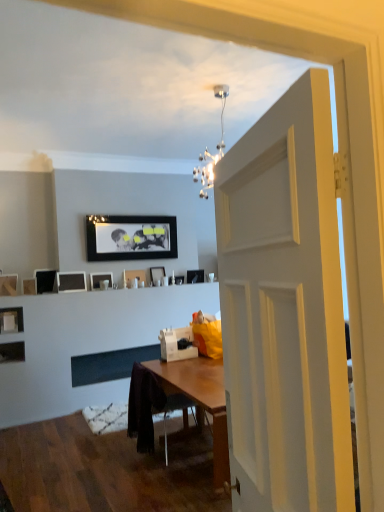
Question: Would you consider matte black picture frame at left, which ranks as the eleventh picture frame in right-to-left order, to be distant from matte black picture frame at upper center, which is counted as the first picture frame, starting from the right?

Choices:
 (A) yes
 (B) no

Answer: (A)

Question: From the image's perspective, does matte black picture frame at left, which is the 1th picture frame in left-to-right order, appear higher than matte black picture frame at upper center, placed as the eleventh picture frame when sorted from left to right?

Choices:
 (A) yes
 (B) no

Answer: (B)

Question: Does matte black picture frame at left, which is the 1th picture frame in left-to-right order, have a greater height compared to matte black picture frame at upper center, placed as the eleventh picture frame when sorted from left to right?

Choices:
 (A) yes
 (B) no

Answer: (A)

Question: From a real-world perspective, is matte black picture frame at left, which ranks as the eleventh picture frame in right-to-left order, located higher than matte black picture frame at upper center, placed as the eleventh picture frame when sorted from left to right?

Choices:
 (A) yes
 (B) no

Answer: (A)

Question: Is matte black picture frame at left, which ranks as the eleventh picture frame in right-to-left order, positioned with its back to matte black picture frame at upper center, placed as the eleventh picture frame when sorted from left to right?

Choices:
 (A) no
 (B) yes

Answer: (A)

Question: Does matte black picture frame at left, which ranks as the eleventh picture frame in right-to-left order, touch matte black picture frame at upper center, placed as the eleventh picture frame when sorted from left to right?

Choices:
 (A) no
 (B) yes

Answer: (A)

Question: From the image's perspective, would you say wooden chair at center is shown under matte black picture frame at left, which ranks as the eleventh picture frame in right-to-left order?

Choices:
 (A) yes
 (B) no

Answer: (A)

Question: Does wooden chair at center have a smaller size compared to matte black picture frame at left, which is the 1th picture frame in left-to-right order?

Choices:
 (A) no
 (B) yes

Answer: (A)

Question: From a real-world perspective, is wooden chair at center on matte black picture frame at left, which ranks as the eleventh picture frame in right-to-left order?

Choices:
 (A) no
 (B) yes

Answer: (A)

Question: From the image's perspective, is wooden chair at center on matte black picture frame at left, which ranks as the eleventh picture frame in right-to-left order?

Choices:
 (A) yes
 (B) no

Answer: (B)

Question: Is there a large distance between wooden chair at center and matte black picture frame at left, which ranks as the eleventh picture frame in right-to-left order?

Choices:
 (A) no
 (B) yes

Answer: (B)

Question: Is wooden chair at center further to the viewer compared to matte black picture frame at left, which is the 1th picture frame in left-to-right order?

Choices:
 (A) yes
 (B) no

Answer: (B)

Question: Does matte black picture frame at left, acting as the tenth picture frame starting from the right, have a lesser height compared to matte black picture frame at upper center, which is counted as the first picture frame, starting from the right?

Choices:
 (A) yes
 (B) no

Answer: (B)